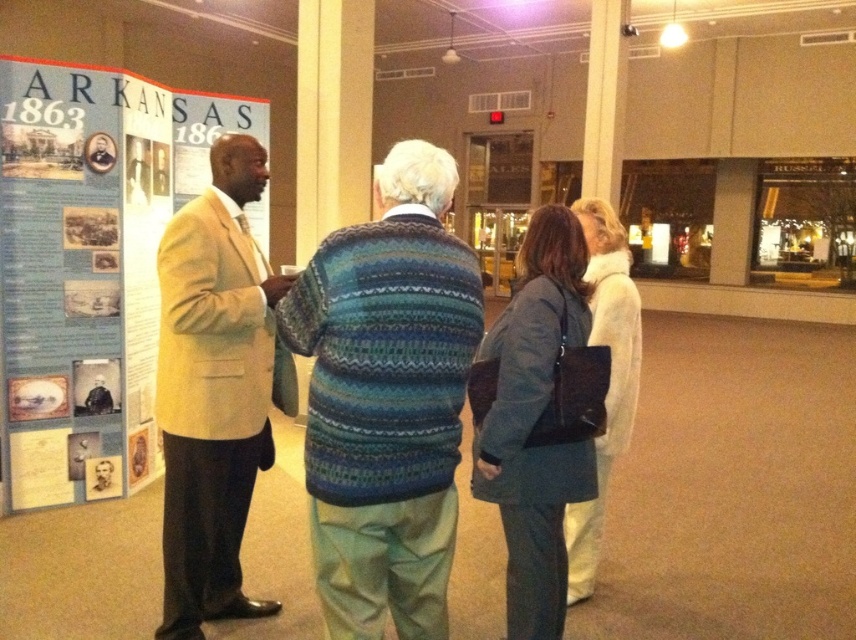
Can you confirm if blue paper poster at left is positioned below knitted sweater at center?

No.

From the picture: Does blue paper poster at left have a smaller size compared to knitted sweater at center?

Incorrect, blue paper poster at left is not smaller in size than knitted sweater at center.

What do you see at coordinates (88, 266) in the screenshot? I see `blue paper poster at left` at bounding box center [88, 266].

Locate an element on the screen. Image resolution: width=856 pixels, height=640 pixels. blue paper poster at left is located at coordinates (88, 266).

Is point (355, 253) farther from viewer compared to point (257, 360)?

No, (355, 253) is closer to viewer.

You are a GUI agent. You are given a task and a screenshot of the screen. Output one action in this format:
    pyautogui.click(x=<x>, y=<y>)
    Task: Click on the knitted sweater at center
    Image resolution: width=856 pixels, height=640 pixels.
    Given the screenshot: What is the action you would take?
    pyautogui.click(x=385, y=400)

Is blue paper poster at left wider than dark gray fabric coat at center?

Yes, blue paper poster at left is wider than dark gray fabric coat at center.

From the picture: Which is more to the right, blue paper poster at left or dark gray fabric coat at center?

From the viewer's perspective, dark gray fabric coat at center appears more on the right side.

Is point (21, 300) farther from viewer compared to point (587, 433)?

That is True.

Locate an element on the screen. blue paper poster at left is located at coordinates (88, 266).